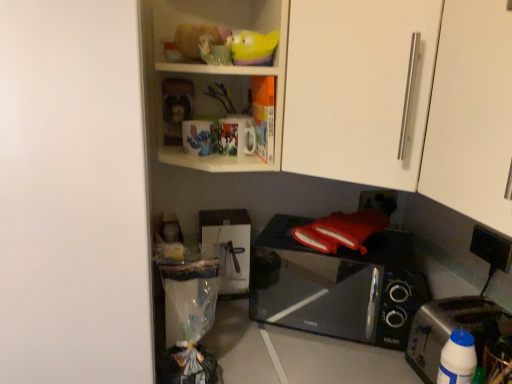
This screenshot has width=512, height=384. Describe the element at coordinates (451, 330) in the screenshot. I see `silver metallic toaster at lower right` at that location.

What are the coordinates of `black plastic electric outlet at lower right` in the screenshot? It's located at (490, 247).

Where is `white matte cabinet door at upper right, which is counted as the first cabinetry, starting from the back`? Image resolution: width=512 pixels, height=384 pixels. white matte cabinet door at upper right, which is counted as the first cabinetry, starting from the back is located at coordinates (358, 89).

The image size is (512, 384). What are the coordinates of `matte plastic shelf at upper center` in the screenshot? It's located at (213, 71).

You are a GUI agent. You are given a task and a screenshot of the screen. Output one action in this format:
    pyautogui.click(x=<x>, y=<y>)
    Task: Click on the white matte door at left
    The height and width of the screenshot is (384, 512).
    Given the screenshot: What is the action you would take?
    pyautogui.click(x=73, y=195)

The width and height of the screenshot is (512, 384). Identify the location of silver metallic toaster at lower right. (451, 330).

Which is in front, point (71, 51) or point (502, 252)?

The point (71, 51) is closer to the camera.

Is white matte door at left located outside black plastic electric outlet at lower right?

Yes.

Is white matte door at left next to black plastic electric outlet at lower right and touching it?

No, white matte door at left is not touching black plastic electric outlet at lower right.

Considering the positions of objects white matte door at left and black plastic electric outlet at lower right in the image provided, who is more to the right, white matte door at left or black plastic electric outlet at lower right?

black plastic electric outlet at lower right.

From the image's perspective, relative to black plastic electric outlet at lower right, is white plastic bottle at lower right above or below?

Based on their image positions, white plastic bottle at lower right is located beneath black plastic electric outlet at lower right.

Would you say white plastic bottle at lower right is a long distance from black plastic electric outlet at lower right?

white plastic bottle at lower right is actually quite close to black plastic electric outlet at lower right.

Is point (470, 346) farther from viewer compared to point (494, 257)?

That is False.

In terms of height, does silver metallic toaster at lower right look taller or shorter compared to white matte door at left?

In the image, silver metallic toaster at lower right appears to be shorter than white matte door at left.

Considering the positions of objects silver metallic toaster at lower right and white matte door at left in the image provided, who is behind, silver metallic toaster at lower right or white matte door at left?

Result: Positioned behind is silver metallic toaster at lower right.

In the scene shown: Considering the relative sizes of silver metallic toaster at lower right and white matte door at left in the image provided, is silver metallic toaster at lower right thinner than white matte door at left?

Yes.

Which is in front, point (149, 333) or point (419, 22)?

Point (419, 22)

Looking at this image, considering the sizes of objects white matte door at left and white matte cabinet door at upper right, which is counted as the first cabinetry, starting from the back, in the image provided, who is taller, white matte door at left or white matte cabinet door at upper right, which is counted as the first cabinetry, starting from the back,?

white matte door at left is taller.

Can you confirm if white matte door at left is bigger than white matte cabinet door at upper right, the second cabinetry when ordered from front to back?

Correct, white matte door at left is larger in size than white matte cabinet door at upper right, the second cabinetry when ordered from front to back.

Can you confirm if white matte door at left is thinner than white matte cabinet door at upper right, which is counted as the first cabinetry, starting from the back?

No, white matte door at left is not thinner than white matte cabinet door at upper right, which is counted as the first cabinetry, starting from the back.

How far apart are matte plastic shelf at upper center and white matte door at left?

matte plastic shelf at upper center is 17.41 inches away from white matte door at left.

Does matte plastic shelf at upper center have a greater width compared to white matte door at left?

No, matte plastic shelf at upper center is not wider than white matte door at left.

In terms of size, does matte plastic shelf at upper center appear bigger or smaller than white matte door at left?

Considering their sizes, matte plastic shelf at upper center takes up less space than white matte door at left.

Considering the positions of objects matte plastic shelf at upper center and white matte door at left in the image provided, who is more to the left, matte plastic shelf at upper center or white matte door at left?

white matte door at left.

Does black plastic electric outlet at lower right have a greater height compared to white plastic bottle at lower right?

No, black plastic electric outlet at lower right is not taller than white plastic bottle at lower right.

Is black plastic electric outlet at lower right in contact with white plastic bottle at lower right?

No, black plastic electric outlet at lower right is not next to white plastic bottle at lower right.

In the image, is black plastic electric outlet at lower right on the left side or the right side of white plastic bottle at lower right?

From the image, it's evident that black plastic electric outlet at lower right is to the right of white plastic bottle at lower right.

Looking at the image, does black plastic electric outlet at lower right seem bigger or smaller compared to white matte cabinet at right, acting as the first cabinetry starting from the front?

Considering their sizes, black plastic electric outlet at lower right takes up less space than white matte cabinet at right, acting as the first cabinetry starting from the front.

How different are the orientations of black plastic electric outlet at lower right and white matte cabinet at right, positioned as the 2th cabinetry in back-to-front order, in degrees?

The angle between the facing direction of black plastic electric outlet at lower right and the facing direction of white matte cabinet at right, positioned as the 2th cabinetry in back-to-front order, is 0.557 degrees.

From the picture: From a real-world perspective, is black plastic electric outlet at lower right positioned over white matte cabinet at right, acting as the first cabinetry starting from the front, based on gravity?

Actually, black plastic electric outlet at lower right is physically below white matte cabinet at right, acting as the first cabinetry starting from the front, in the real world.

Is black plastic electric outlet at lower right facing away from white matte cabinet at right, positioned as the 2th cabinetry in back-to-front order?

No.

Locate an element on the screen. The width and height of the screenshot is (512, 384). door lying in front of the black plastic electric outlet at lower right is located at coordinates (73, 195).

This screenshot has height=384, width=512. Identify the location of electric outlet above the white plastic bottle at lower right (from the image's perspective). click(x=490, y=247).

Looking at the image, which one is located further to silver metallic toaster at lower right, white matte cabinet at right, acting as the first cabinetry starting from the front, or white matte door at left?

white matte door at left is positioned further to the anchor silver metallic toaster at lower right.

Estimate the real-world distances between objects in this image. Which object is further from white plastic bottle at lower right, white matte cabinet door at upper right, which is counted as the first cabinetry, starting from the back, or matte plastic shelf at upper center?

matte plastic shelf at upper center is positioned further to the anchor white plastic bottle at lower right.

Estimate the real-world distances between objects in this image. Which object is further from white matte cabinet door at upper right, the second cabinetry when ordered from front to back, silver metallic toaster at lower right or black glossy microwave oven at lower right?

silver metallic toaster at lower right is further to white matte cabinet door at upper right, the second cabinetry when ordered from front to back.

Looking at the image, which one is located closer to yellow rubber duck at upper center, black glossy microwave oven at lower right or white matte cabinet at right, positioned as the 2th cabinetry in back-to-front order?

white matte cabinet at right, positioned as the 2th cabinetry in back-to-front order, lies closer to yellow rubber duck at upper center than the other object.

From the image, which object appears to be farther from black glossy microwave oven at lower right, black plastic electric outlet at lower right or white matte door at left?

white matte door at left is further to black glossy microwave oven at lower right.

Considering their positions, is black plastic electric outlet at lower right positioned closer to white matte cabinet door at upper right, the second cabinetry when ordered from front to back, than black glossy microwave oven at lower right?

Among the two, black plastic electric outlet at lower right is located nearer to white matte cabinet door at upper right, the second cabinetry when ordered from front to back.

From the image, which object appears to be farther from yellow rubber duck at upper center, white matte cabinet door at upper right, the second cabinetry when ordered from front to back, or black glossy microwave oven at lower right?

black glossy microwave oven at lower right.

Estimate the real-world distances between objects in this image. Which object is closer to yellow rubber duck at upper center, white matte door at left or white matte cabinet at right, acting as the first cabinetry starting from the front?

white matte cabinet at right, acting as the first cabinetry starting from the front, is positioned closer to the anchor yellow rubber duck at upper center.

Identify the location of toaster that lies between white matte cabinet door at upper right, which is counted as the first cabinetry, starting from the back, and white plastic bottle at lower right from top to bottom. (451, 330).

This screenshot has height=384, width=512. Identify the location of cabinetry situated between yellow rubber duck at upper center and white matte cabinet at right, acting as the first cabinetry starting from the front, from left to right. (358, 89).

Image resolution: width=512 pixels, height=384 pixels. Find the location of `electric outlet between yellow rubber duck at upper center and white plastic bottle at lower right in the up-down direction`. electric outlet between yellow rubber duck at upper center and white plastic bottle at lower right in the up-down direction is located at coordinates (490, 247).

Locate an element on the screen. The height and width of the screenshot is (384, 512). toy located between white matte door at left and white plastic bottle at lower right in the left-right direction is located at coordinates (252, 47).